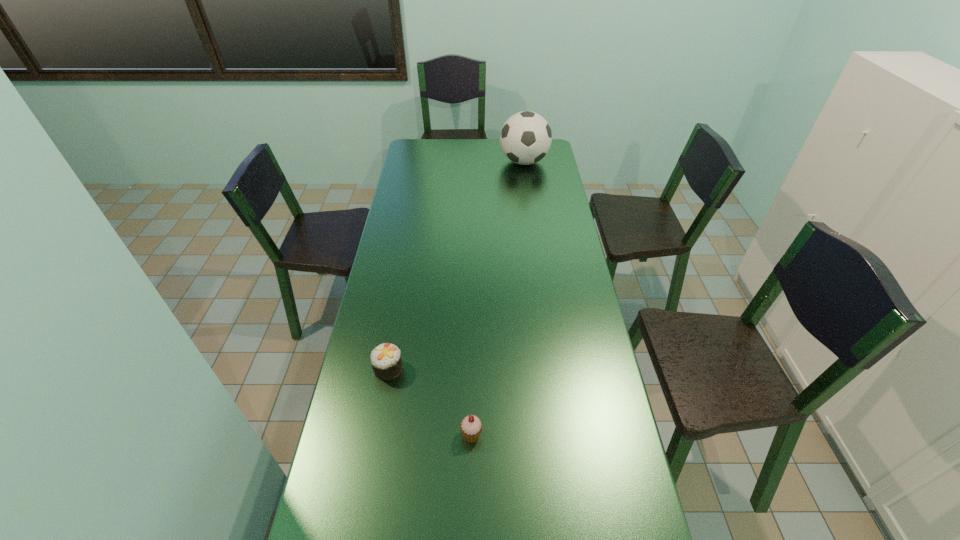
Locate an element on the screen. the rightmost object is located at coordinates (525, 138).

Identify the location of soccer ball. (525, 138).

This screenshot has width=960, height=540. Identify the location of the second nearest object. (386, 362).

Where is `the farther cupcake`? Image resolution: width=960 pixels, height=540 pixels. the farther cupcake is located at coordinates (386, 362).

This screenshot has height=540, width=960. What are the coordinates of `the nearer cupcake` in the screenshot? It's located at (471, 427).

Find the location of `the nearest object`. the nearest object is located at coordinates (471, 427).

Identify the location of free space located on the left of the farthest object. The width and height of the screenshot is (960, 540). (473, 162).

Where is `vacant space located on the right of the left cupcake`? This screenshot has height=540, width=960. vacant space located on the right of the left cupcake is located at coordinates (533, 369).

Image resolution: width=960 pixels, height=540 pixels. Find the location of `vacant point located 0.210m on the front of the second object from left to right`. vacant point located 0.210m on the front of the second object from left to right is located at coordinates (470, 535).

The width and height of the screenshot is (960, 540). What are the coordinates of `object located at the far edge` in the screenshot? It's located at (525, 138).